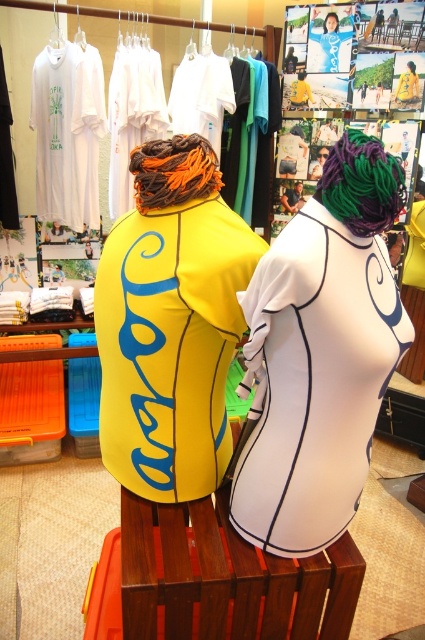
You are a customer in the store and want to locate the multicolored braided hair at center. Based on the scene description, where would you look relative to the two mannequins?

The multicolored braided hair at center is located at point (362, 184), which is closer to the left mannequin since it is positioned at the center between them.

You are standing in front of the retail display and want to locate the yellow matte wetsuit at center. Which object from the following list is closest to the point marked at coordinates (170, 323)? The options are the bright yellow wetsuit with bold blue lettering Jamaica on its back or the white wetsuit with black outlines and a large stylized eye graphic on the back.

The yellow matte wetsuit at center is located at point (170, 323), so the closest object to this point is the bright yellow wetsuit with bold blue lettering Jamaica on its back.

Looking at this image, you are a store employee arranging items in the retail display. You need to place a decorative sign between the two mannequins. The sign is 36 inches wide. Will there be enough space between the multicolored braided hair at center and the other mannequin to fit the sign?

The distance between the multicolored braided hair at center and the other mannequin is 35.18 inches. Since the sign is 36 inches wide, it will not fit as the space is slightly narrower than the sign.